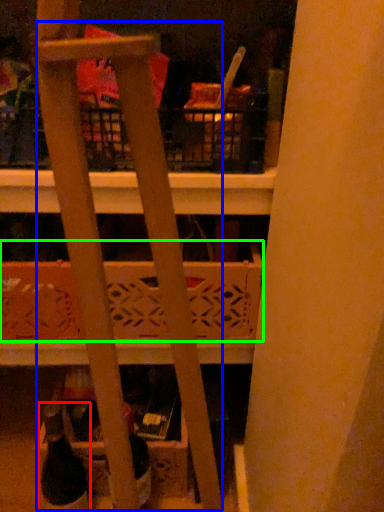
Question: Based on their relative distances, which object is farther from wine bottle (highlighted by a red box)? Choose from ladder (highlighted by a blue box) and basket (highlighted by a green box).

Choices:
 (A) ladder
 (B) basket

Answer: (A)